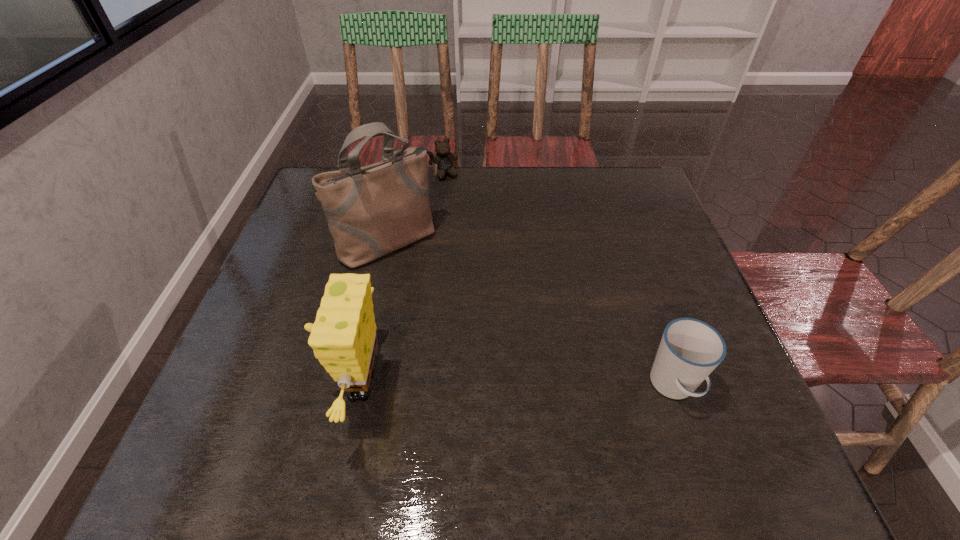
You are a GUI agent. You are given a task and a screenshot of the screen. Output one action in this format:
    pyautogui.click(x=<x>, y=<y>)
    Task: Click on the object situated at the right edge
    
    Given the screenshot: What is the action you would take?
    pyautogui.click(x=690, y=349)

Find the location of `object at the near right corner`. object at the near right corner is located at coordinates (690, 349).

In the image, there is a desktop. Identify the location of vacant space at the far edge. (529, 167).

I want to click on free spot at the near edge of the desktop, so click(x=406, y=407).

The width and height of the screenshot is (960, 540). I want to click on vacant area at the left edge of the desktop, so click(x=307, y=261).

Locate an element on the screen. The image size is (960, 540). free space at the right edge of the desktop is located at coordinates (652, 236).

Locate an element on the screen. vacant region at the far left corner of the desktop is located at coordinates (317, 209).

The image size is (960, 540). I want to click on free region at the far right corner, so click(623, 187).

Where is `free point between the sponge and the rightmost object`? Image resolution: width=960 pixels, height=540 pixels. free point between the sponge and the rightmost object is located at coordinates (516, 386).

Identify the location of free space between the sponge and the teddy bear. This screenshot has height=540, width=960. (400, 280).